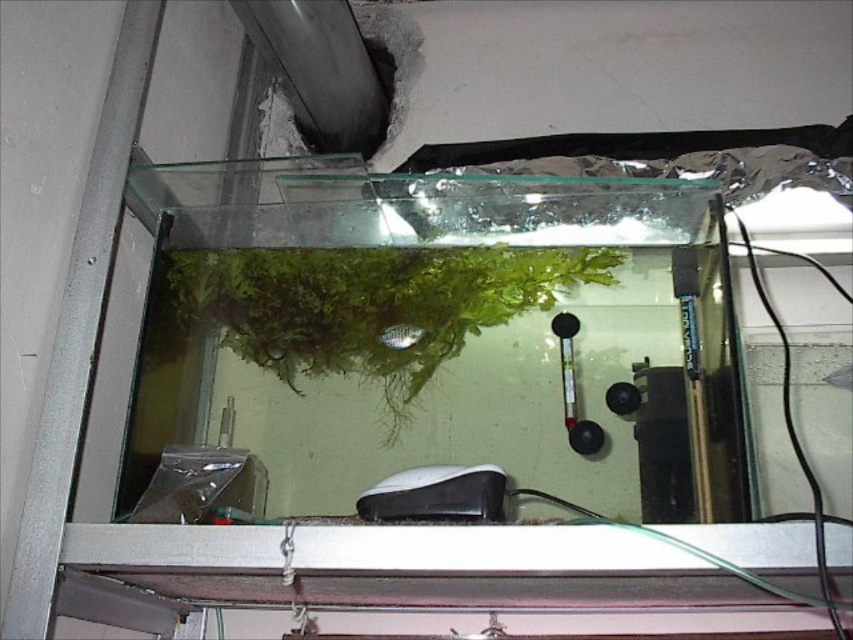
Does green matte plant at center have a lesser width compared to white matte air pump at bottom?

No, green matte plant at center is not thinner than white matte air pump at bottom.

Describe the element at coordinates (363, 305) in the screenshot. I see `green matte plant at center` at that location.

Which is behind, point (241, 284) or point (462, 512)?

Positioned behind is point (241, 284).

Find the location of a particular element. The height and width of the screenshot is (640, 853). green matte plant at center is located at coordinates (363, 305).

Is green matte plant at center closer to camera compared to green matte fish at center?

Yes, it is.

Who is taller, green matte plant at center or green matte fish at center?

green matte plant at center is taller.

The image size is (853, 640). What are the coordinates of `green matte plant at center` in the screenshot? It's located at (363, 305).

Does white matte air pump at bottom have a lesser height compared to green matte fish at center?

No, white matte air pump at bottom is not shorter than green matte fish at center.

Between point (375, 492) and point (413, 324), which one is positioned behind?

Positioned behind is point (413, 324).

Where is `white matte air pump at bottom`? The height and width of the screenshot is (640, 853). white matte air pump at bottom is located at coordinates (436, 493).

At what (x,y) coordinates should I click in order to perform the action: click on white matte air pump at bottom. Please return your answer as a coordinate pair (x, y). This screenshot has width=853, height=640. Looking at the image, I should click on (436, 493).